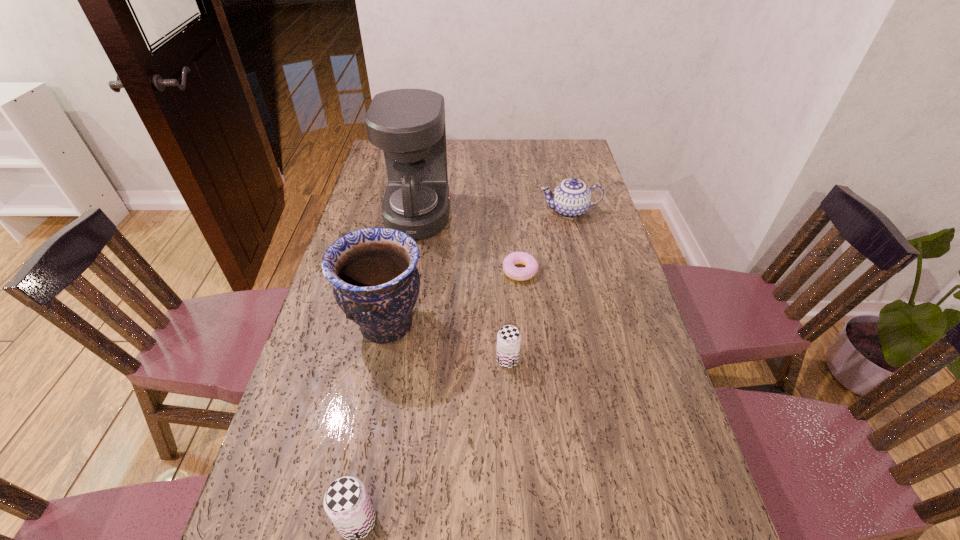
Please show where to add a beer can on the right while keeping spacing even. Please provide its 2D coordinates. Your answer should be formatted as a tuple, i.e. [(x, y)], where the tuple contains the x and y coordinates of a point satisfying the conditions above.

[(599, 261)]